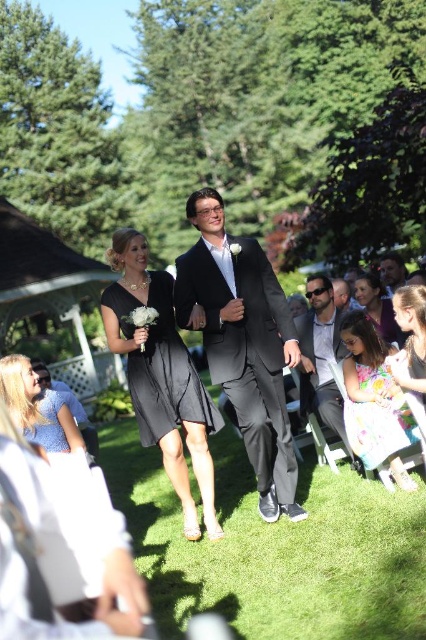
Who is taller, shiny black suit at center or silky floral dress at lower right?

With more height is shiny black suit at center.

Is shiny black suit at center closer to camera compared to silky floral dress at lower right?

No, it is behind silky floral dress at lower right.

At what (x,y) coordinates should I click in order to perform the action: click on shiny black suit at center. Please return your answer as a coordinate pair (x, y). Looking at the image, I should click on (242, 342).

Is point (319, 355) closer to camera compared to point (6, 403)?

No, it is behind (6, 403).

Is matte black suit at center positioned at the back of blue cotton dress at lower left?

Yes, it is.

Does point (331, 356) come behind point (20, 369)?

Yes, point (331, 356) is behind point (20, 369).

Find the location of `matte black suit at center`. matte black suit at center is located at coordinates (321, 355).

Does shiny black suit at center have a lesser width compared to matte black suit at center?

Incorrect, shiny black suit at center's width is not less than matte black suit at center's.

Who is taller, shiny black suit at center or matte black suit at center?

Standing taller between the two is shiny black suit at center.

Is point (275, 326) more distant than point (313, 403)?

No, (275, 326) is closer to viewer.

Where is `shiny black suit at center`? The height and width of the screenshot is (640, 426). shiny black suit at center is located at coordinates (242, 342).